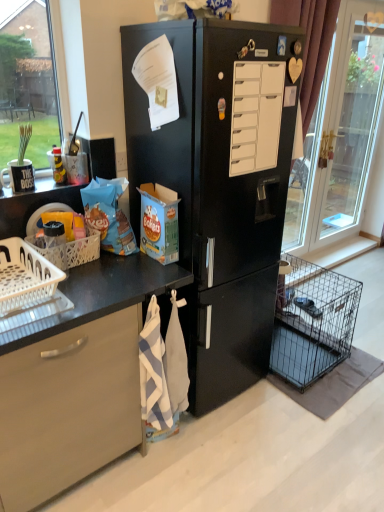
Question: Is white plastic basket at lower left, the 2th basket in the front-to-back sequence, situated inside white striped towel at lower center or outside?

Choices:
 (A) outside
 (B) inside

Answer: (A)

Question: Considering the positions of white plastic basket at lower left, the 2th basket in the front-to-back sequence, and white striped towel at lower center in the image, is white plastic basket at lower left, the 2th basket in the front-to-back sequence, bigger or smaller than white striped towel at lower center?

Choices:
 (A) big
 (B) small

Answer: (B)

Question: Estimate the real-world distances between objects in this image. Which object is closer to the white striped towel at lower center?

Choices:
 (A) black wire dog crate at lower right
 (B) white plastic basket at left, the 2th basket when ordered from back to front
 (C) transparent glass door at right
 (D) white plastic basket at lower left, the 1th basket when ordered from back to front
 (E) black matte refrigerator at center

Answer: (E)

Question: Considering the real-world distances, which object is farthest from the white matte drawer at center?

Choices:
 (A) black wire dog crate at lower right
 (B) black matte refrigerator at center
 (C) white plastic basket at left, the 2th basket when ordered from back to front
 (D) transparent glass door at right
 (E) white striped towel at lower center

Answer: (D)